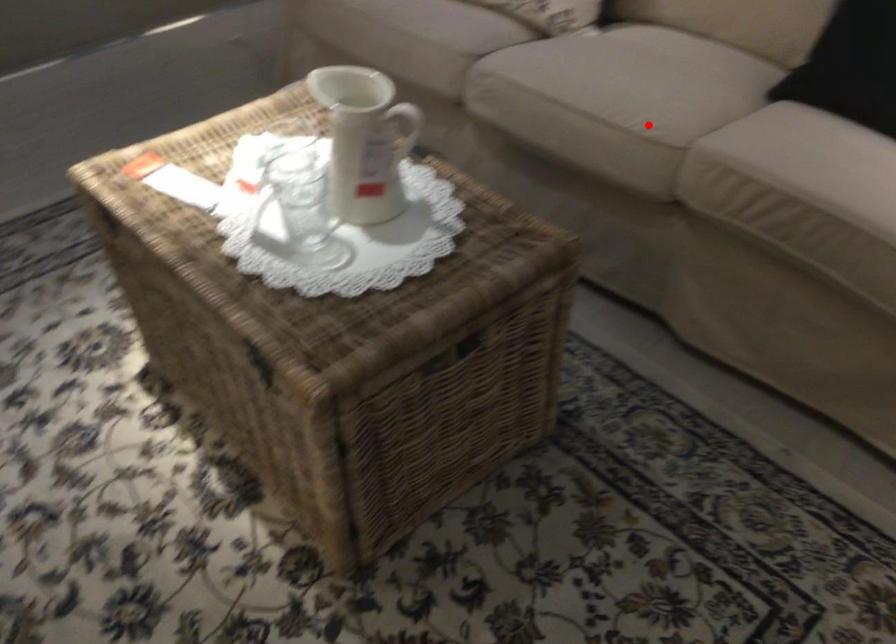
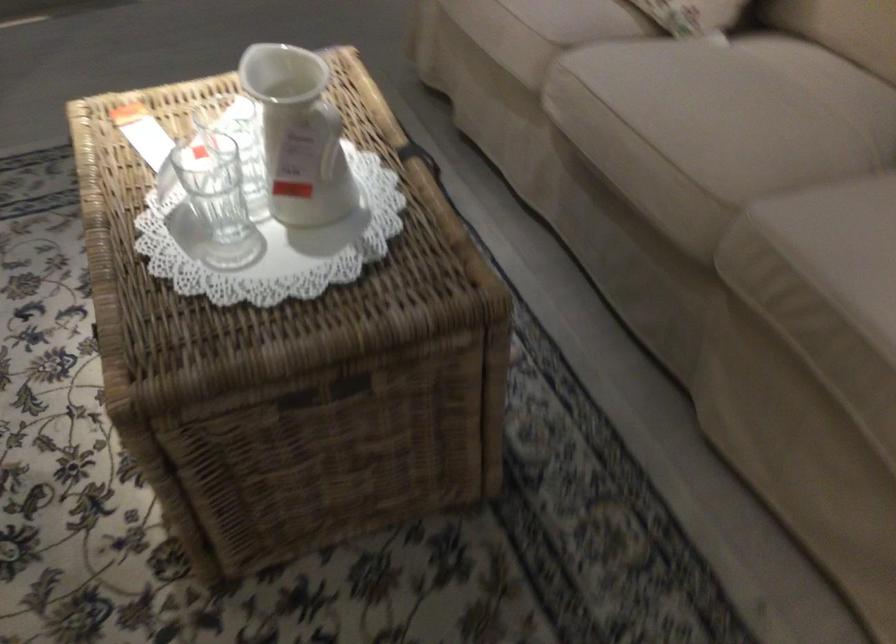
Question: I am providing you with two images of the same scene from different viewpoints. A red point is shown in image1. For the corresponding object point in image2, is it positioned nearer or farther from the camera?

Choices:
 (A) Nearer
 (B) Farther

Answer: (A)